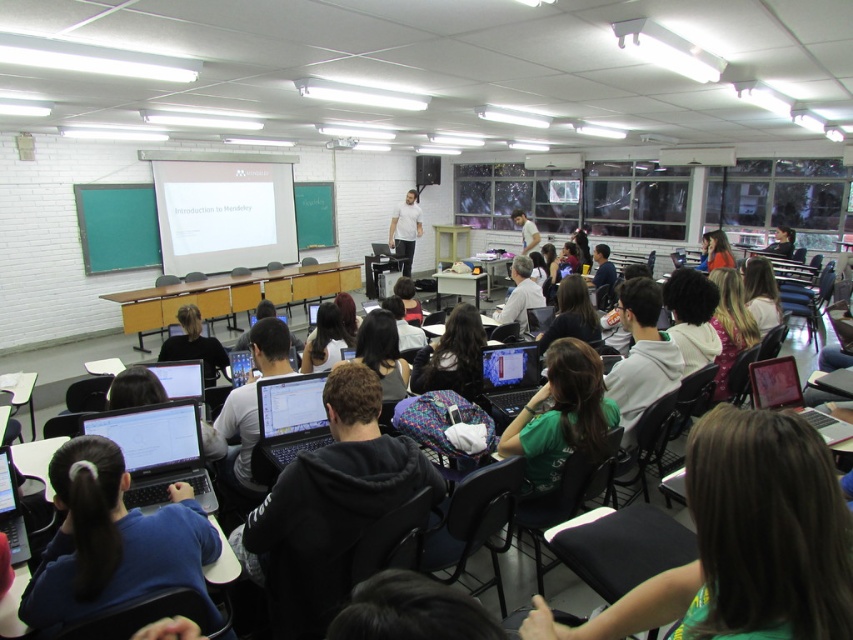
You are a photographer standing at the back of the classroom. You want to take a photo of the green fabric shirt at center and the black matte shirt at center. Which shirt should you focus on first if you want to capture both in the same frame without moving the camera?

The green fabric shirt at center has a lesser width compared to the black matte shirt at center, so you should focus on the black matte shirt at center first since it is wider and might require more attention to fit properly in the frame.

From the picture: You are a student who needs to place a book between the satin black laptop at center and the white matte shirt at center. Which object should you place the book closer to to ensure it doesn not block the view of the laptop screen?

The satin black laptop at center is not as tall as the white matte shirt at center. To avoid blocking the laptop screen, place the book closer to the taller object, which is the white matte shirt at center.

You are a student sitting at the desk with the black glossy laptop at lower left. You need to hand in an assignment to the professor who is standing by the satin black laptop at center. Can you reach the professor without moving your laptop?

The black glossy laptop at lower left is behind the satin black laptop at center, so you cannot reach the professor without moving your laptop.